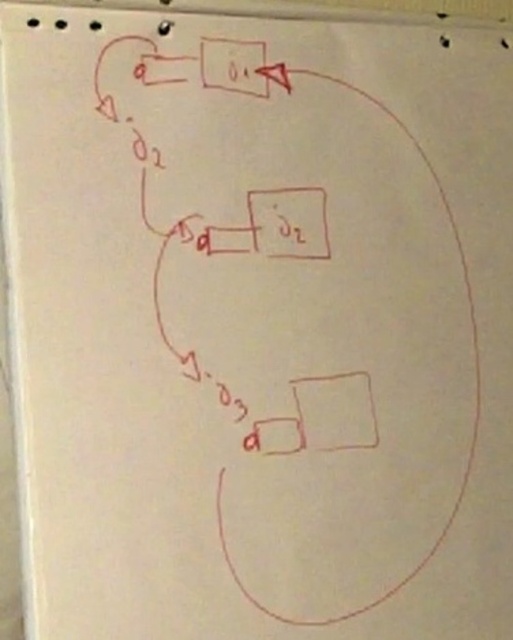
You are standing 36 inches away from the white paper notepad at lower right. Can you reach it without moving your feet?

The white paper notepad at lower right is 34.24 inches away from the camera. Since you are standing 36 inches away, you are slightly farther than the notepad, so you might need to step closer to reach it.

You are an artist trying to hang a matte black rectangle at center on the wall. You have a white paper notepad at lower right that you want to place below it. Will the notepad fit below the rectangle vertically without overlapping?

The white paper notepad at lower right is much taller than the matte black rectangle at center, so placing it below the rectangle vertically would require more space than available. The notepad may overlap or not fit properly due to its greater height.

You are an artist trying to hang a matte black rectangle at center on a wall. The wall has a white paper notepad at lower right already pinned there. How far apart are these two items?

The white paper notepad at lower right is 18.83 centimeters from the matte black rectangle at center.